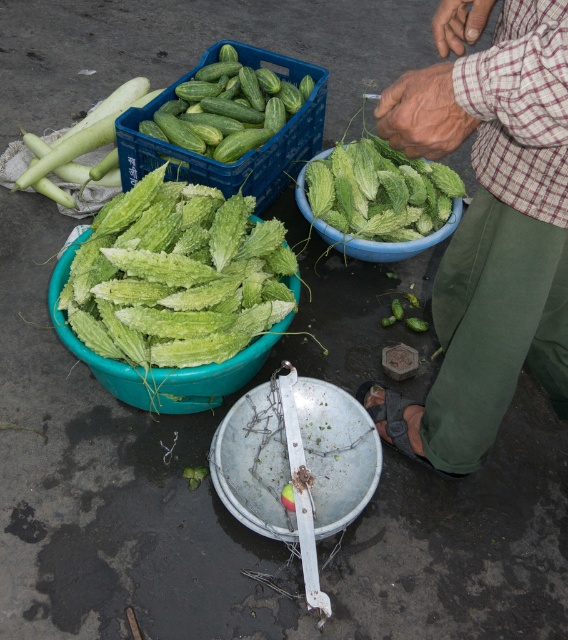
From the picture: You are standing at the market and want to reach the point labeled as point (135,339). If your arm is 1.5 meters long, can you touch that point without moving your feet?

The point (135,339) is 1.56 meters away from the viewer. Since your arm is 1.5 meters long, you cannot reach it without moving your feet.

You are standing in front of the vegetable stall and want to pick up two items. The first item is at point (516, 288) and the second item is at point (132, 337). Which item will you reach first if you move towards them at the same time?

You will reach the item at point (516, 288) first because it is closer to you than the item at point (132, 337).